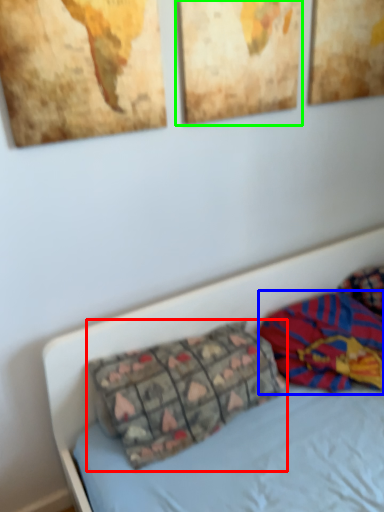
Question: Which is nearer to the pillow (highlighted by a red box)? material (highlighted by a blue box) or picture frame (highlighted by a green box).

Choices:
 (A) material
 (B) picture frame

Answer: (A)